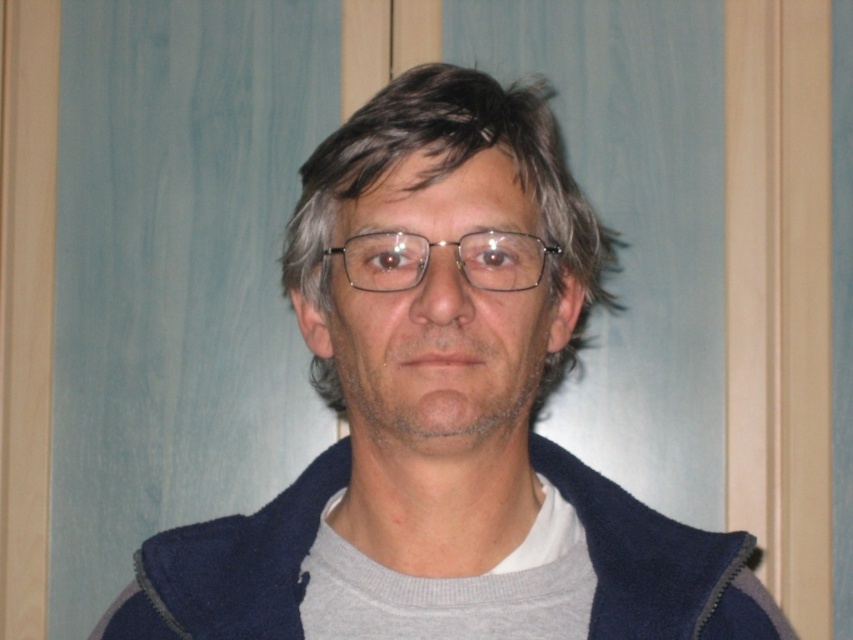
Between point (328, 492) and point (500, 246), which one is positioned in front?

Point (500, 246)

Which of these two, navy fleece jacket at center or clear plastic glasses at center, stands taller?

With more height is navy fleece jacket at center.

Identify the location of navy fleece jacket at center. The height and width of the screenshot is (640, 853). coord(231,566).

Does navy fleece jacket at center lie behind gray matte hair at center?

Yes, navy fleece jacket at center is further from the viewer.

From the picture: Between navy fleece jacket at center and gray matte hair at center, which one appears on the right side from the viewer's perspective?

Positioned to the right is gray matte hair at center.

Who is more distant from viewer, (210, 536) or (309, 220)?

Point (210, 536)

I want to click on navy fleece jacket at center, so click(x=231, y=566).

Can you confirm if gray matte hair at center is taller than clear plastic glasses at center?

Yes, gray matte hair at center is taller than clear plastic glasses at center.

Is point (283, 291) more distant than point (473, 285)?

Yes, point (283, 291) is farther from viewer.

Identify the location of gray matte hair at center. The image size is (853, 640). (450, 173).

Locate an element on the screen. The image size is (853, 640). gray matte hair at center is located at coordinates (450, 173).